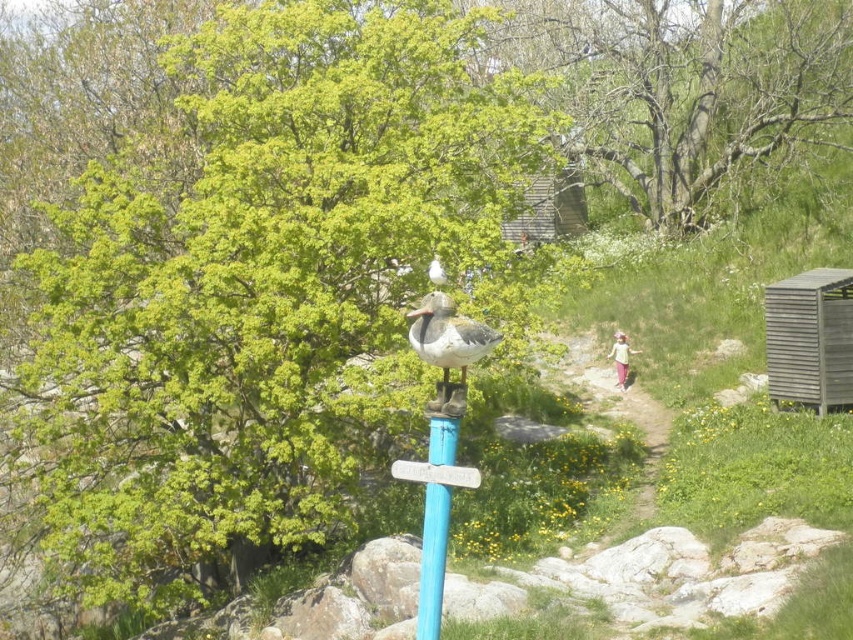
Question: Which point is farther to the camera?

Choices:
 (A) (836, 298)
 (B) (596, 35)
 (C) (433, 278)

Answer: (B)

Question: Does green leafy tree at center appear over matte gray duck at center?

Choices:
 (A) no
 (B) yes

Answer: (B)

Question: Is green leafy tree at upper center behind white matte duck at center?

Choices:
 (A) no
 (B) yes

Answer: (B)

Question: Which of these objects is positioned farthest from the wooden shed at right?

Choices:
 (A) matte gray duck at center
 (B) blue painted wood post at center
 (C) white matte duck at center
 (D) green leafy tree at upper center

Answer: (D)

Question: Does green leafy tree at upper center have a greater width compared to blue painted wood post at center?

Choices:
 (A) no
 (B) yes

Answer: (A)

Question: Which of the following is the farthest from the observer?

Choices:
 (A) (636, 38)
 (B) (53, 298)
 (C) (439, 573)
 (D) (849, 308)

Answer: (A)